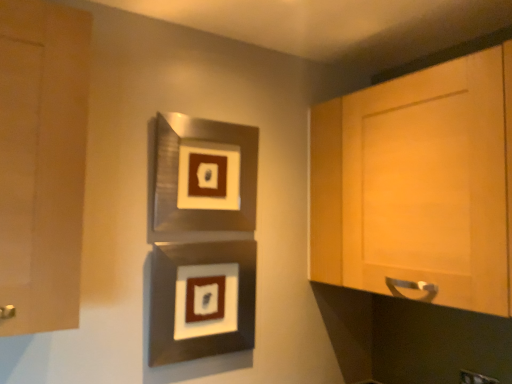
Question: From a real-world perspective, is light wood cabinet at right, which ranks as the second cabinetry in left-to-right order, positioned above or below matte wood cabinet at left, which is the 1th cabinetry from left to right?

Choices:
 (A) below
 (B) above

Answer: (A)

Question: Is light wood cabinet at right, the 1th cabinetry in the right-to-left sequence, in front of or behind matte wood cabinet at left, the second cabinetry positioned from the right, in the image?

Choices:
 (A) behind
 (B) front

Answer: (A)

Question: Which object is positioned farthest from the matte wood cabinet at left, which is the 1th cabinetry from left to right?

Choices:
 (A) light wood cabinet at right, the 1th cabinetry in the right-to-left sequence
 (B) metallic silver picture frame at center, which ranks as the first picture frame in top-to-bottom order
 (C) metallic silver picture frame at center, positioned as the 2th picture frame in top-to-bottom order

Answer: (A)

Question: Considering the real-world distances, which object is farthest from the metallic silver picture frame at center, which ranks as the first picture frame in top-to-bottom order?

Choices:
 (A) light wood cabinet at right, which ranks as the second cabinetry in left-to-right order
 (B) metallic silver picture frame at center, the first picture frame positioned from the bottom
 (C) matte wood cabinet at left, which is the 1th cabinetry from left to right

Answer: (C)